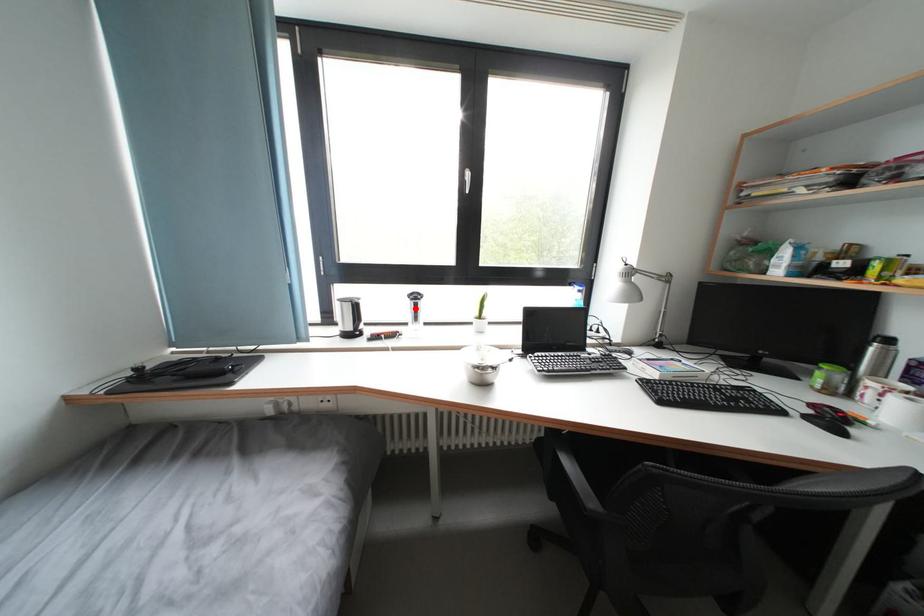
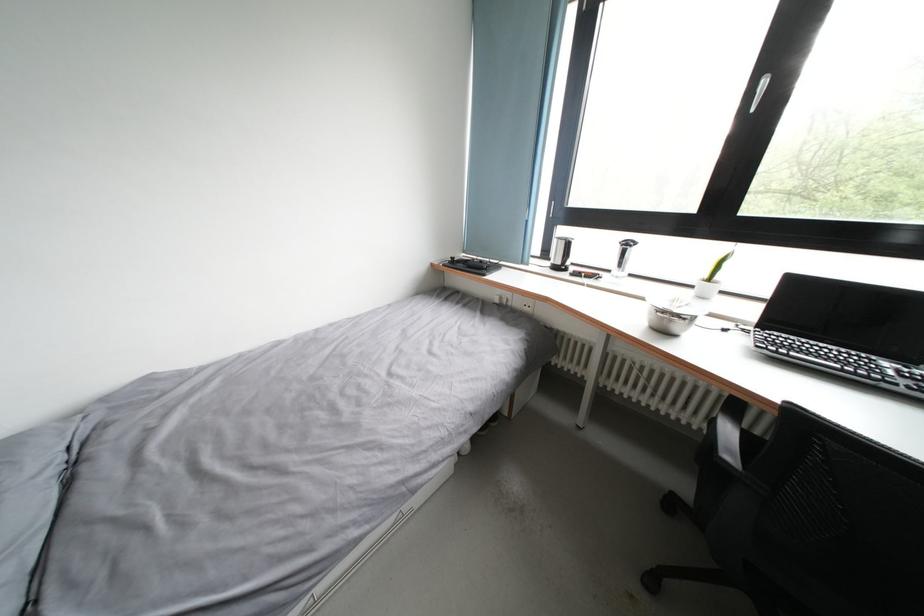
Question: I am providing you with two images of the same scene from different viewpoints. Given a red point in image1, look at the same physical point in image2. Is it:

Choices:
 (A) Closer to the viewpoint
 (B) Farther from the viewpoint

Answer: (A)